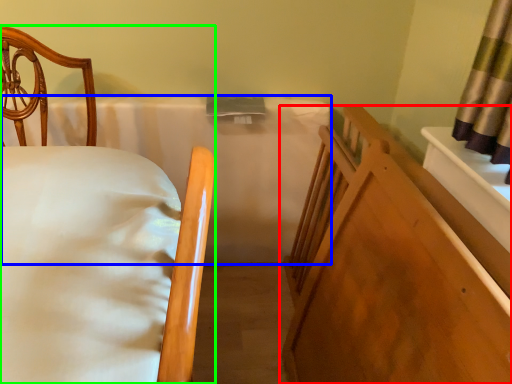
Question: Estimate the real-world distances between objects in this image. Which object is closer to furniture (highlighted by a red box), mattress (highlighted by a blue box) or bed (highlighted by a green box)?

Choices:
 (A) mattress
 (B) bed

Answer: (B)